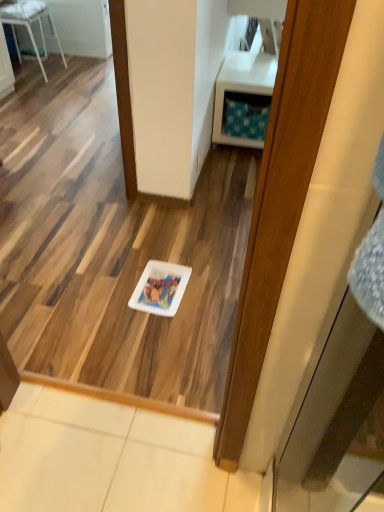
At what (x,y) coordinates should I click in order to perform the action: click on vacant area situated to the left side of white glossy plate at center. Please return your answer as a coordinate pair (x, y). The height and width of the screenshot is (512, 384). Looking at the image, I should click on pos(111,288).